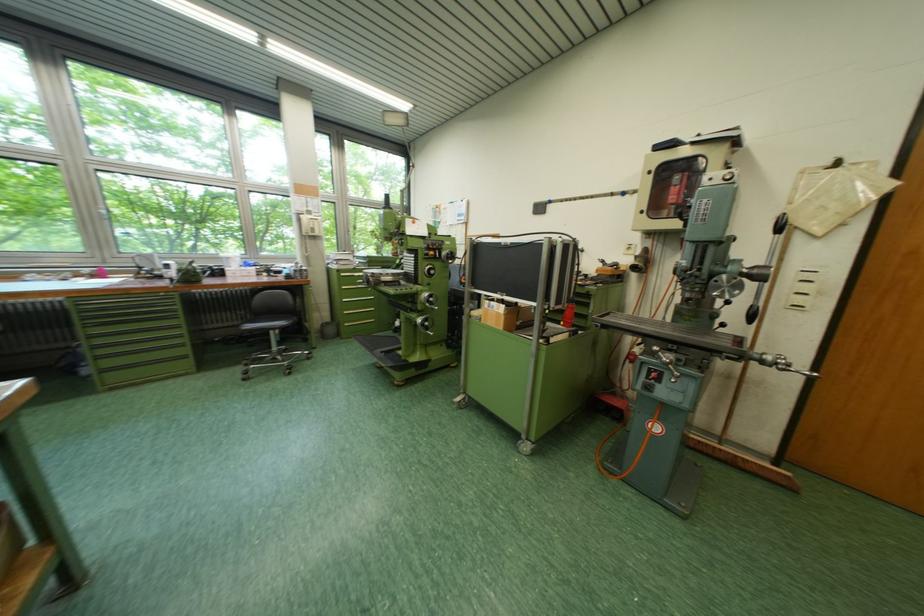
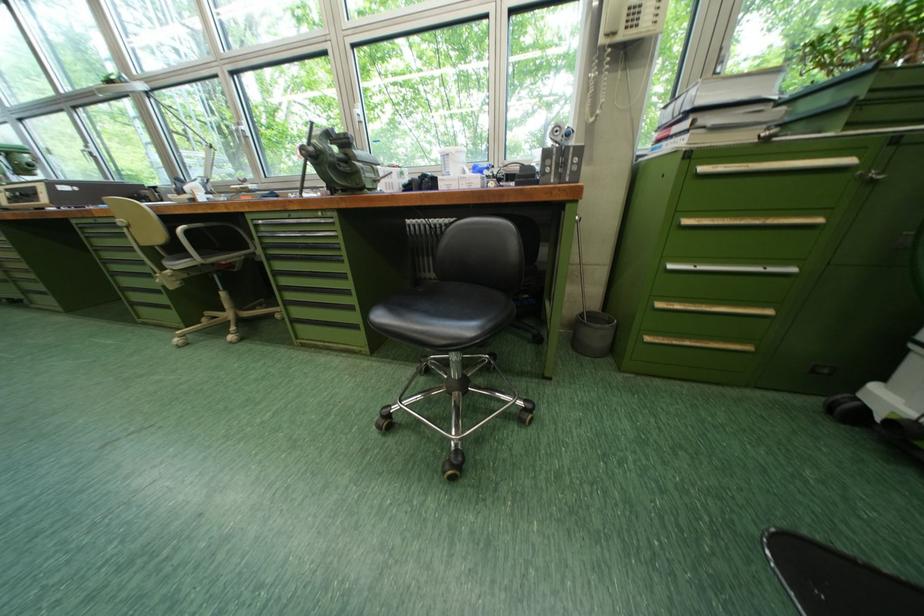
Locate, in the second image, the point that corresponds to point 355,302 in the first image.

(681, 269)